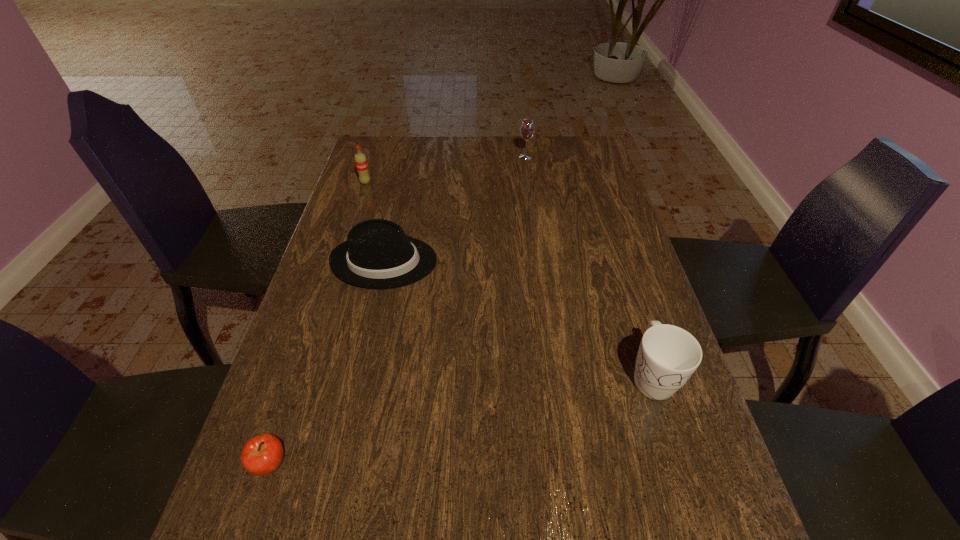
At what (x,y) coordinates should I click in order to perform the action: click on vacant area in the image that satisfies the following two spatial constraints: 1. on the back side of the second object from right to left; 2. on the left side of the fourth nearest object. Please return your answer as a coordinate pair (x, y). The image size is (960, 540). Looking at the image, I should click on (373, 157).